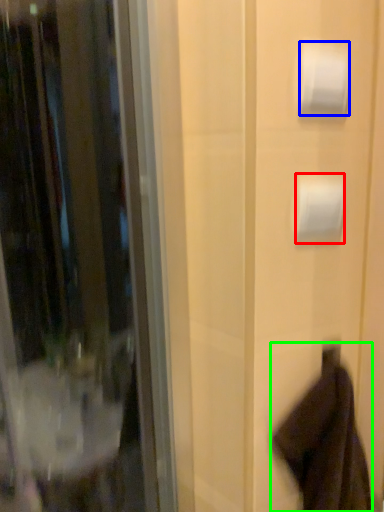
Question: Which object is the farthest from toilet paper (highlighted by a red box)? Choose among these: toilet paper (highlighted by a blue box) or robe (highlighted by a green box).

Choices:
 (A) toilet paper
 (B) robe

Answer: (B)